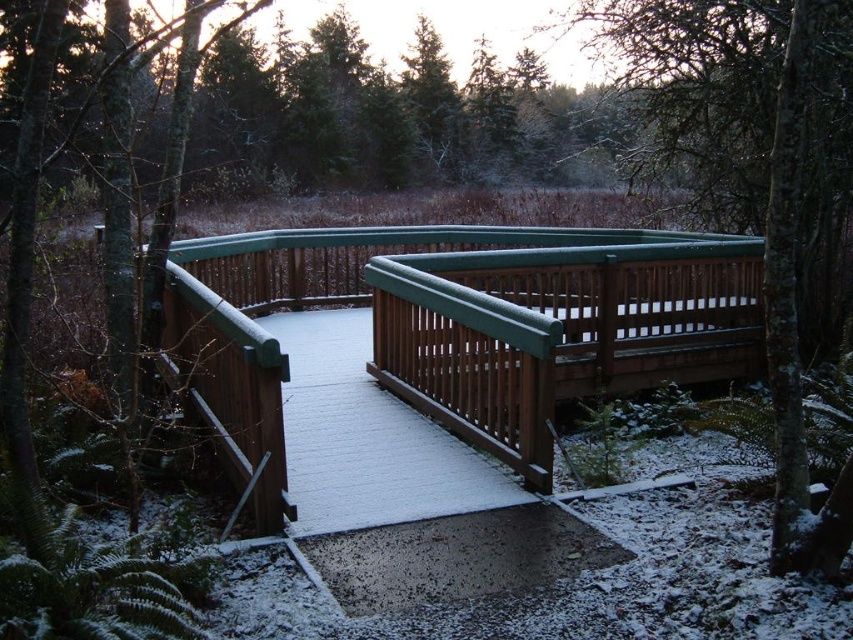
In the scene shown: You are a hiker carrying a heavy backpack and need to cross the wooden bridge at center. There is a green matte fence at upper center nearby. Which object is located lower in the scene?

The wooden bridge at center is located below the green matte fence at upper center, so the wooden bridge at center is lower in the scene.

You are a hiker carrying a large backpack and need to cross the wooden bridge at center. The green matte fence at upper center is nearby. Considering their widths, which structure is narrower?

The wooden bridge at center is thinner than the green matte fence at upper center, so the wooden bridge at center is narrower.

You are standing on the wooden bridge in the forest and want to reach a point that is closer to you. Which point should you head towards, point (381, 344) or point (780, 145)?

You should head towards point (381, 344) because it is closer to you than point (780, 145).